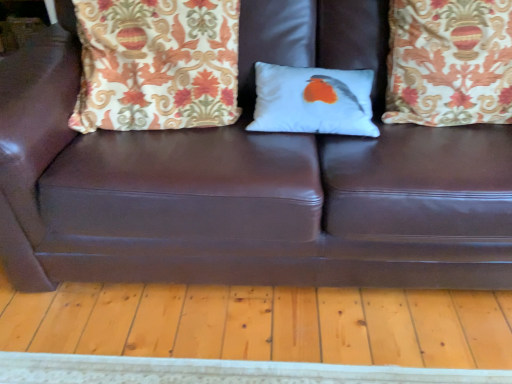
Question: Is patterned fabric pillow at upper right, which appears as the third pillow when viewed from the left, bigger or smaller than white matte pillow with bird design at center, which is the second pillow from right to left?

Choices:
 (A) big
 (B) small

Answer: (A)

Question: Would you say patterned fabric pillow at upper right, which appears as the third pillow when viewed from the left, is to the left or to the right of white matte pillow with bird design at center, the 2th pillow positioned from the left, in the picture?

Choices:
 (A) left
 (B) right

Answer: (B)

Question: Estimate the real-world distances between objects in this image. Which object is farther from the white matte pillow with bird design at center, which is the second pillow from right to left?

Choices:
 (A) patterned fabric pillow at upper left, placed as the 1th pillow when sorted from left to right
 (B) patterned fabric pillow at upper right, which appears as the third pillow when viewed from the left

Answer: (A)

Question: Estimate the real-world distances between objects in this image. Which object is closer to the white matte pillow with bird design at center, the 2th pillow positioned from the left?

Choices:
 (A) patterned fabric pillow at upper right, the first pillow when ordered from right to left
 (B) patterned fabric pillow at upper left, the third pillow positioned from the right

Answer: (A)